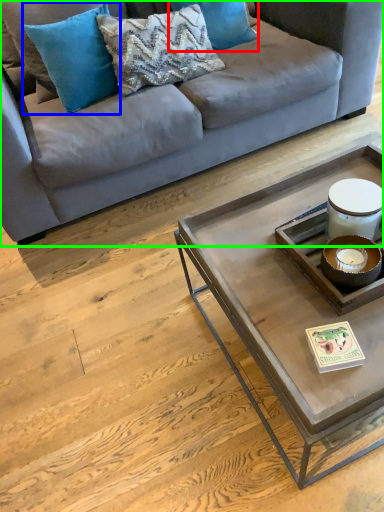
Question: Considering the real-world distances, which object is closest to pillow (highlighted by a red box)? pillow (highlighted by a blue box) or studio couch (highlighted by a green box).

Choices:
 (A) pillow
 (B) studio couch

Answer: (B)